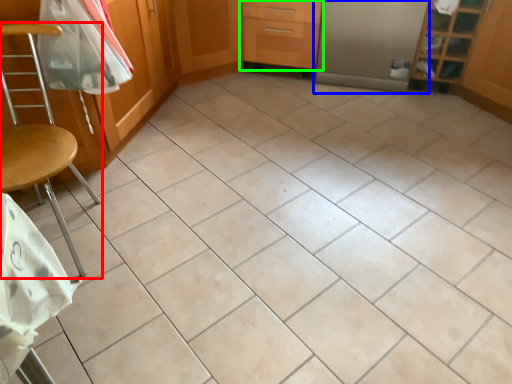
Question: Based on their relative distances, which object is farther from chair (highlighted by a red box)? Choose from screen door (highlighted by a blue box) and drawer (highlighted by a green box).

Choices:
 (A) screen door
 (B) drawer

Answer: (A)